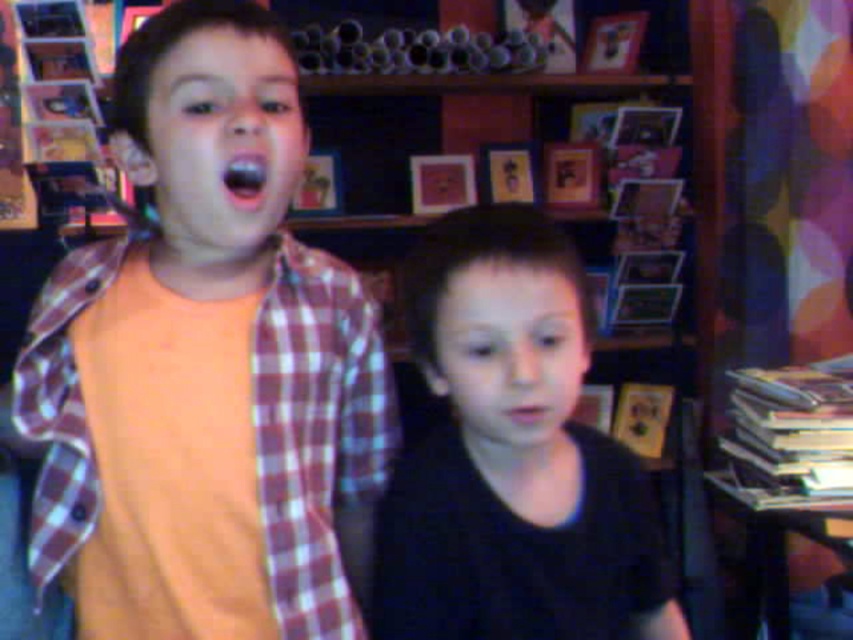
You are a photographer standing at the camera position. You want to take a closeup of the black matte shirt at center. Can you reach it with your hand without moving your body?

The black matte shirt at center is 76.14 centimeters away from camera, so yes, you can reach it with your hand without moving your body since it is within arm reach.

You are a photographer setting up a shoot in this room. You need to position a light source to the right of the orange cotton shirt at left but to the left of the black matte shirt at center. Is this possible given their positions?

The black matte shirt at center is to the right of the orange cotton shirt at left, so there is space between them where the light source can be placed to satisfy both conditions.

You are standing in the room and want to move from the point at coordinates point (547, 531) to point (305, 378). According to the image, which direction should you move to get from the first point to the second?

You should move backward because point (547, 531) is in front of point (305, 378), so moving from the first to the second requires going in the opposite direction.